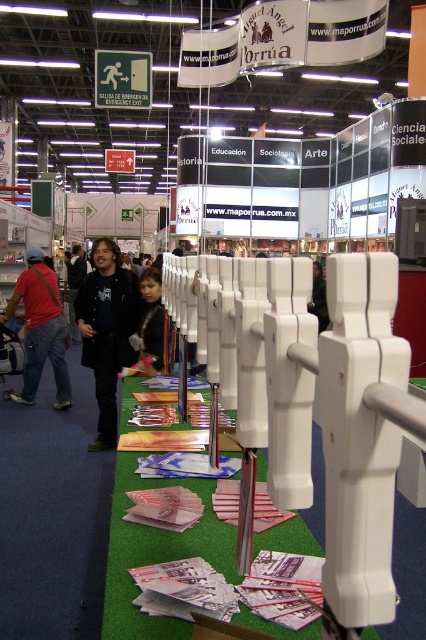
You are at an educational trade show and see two black items. One is the black matte jacket at left and the other is the black fabric at center. Which one is positioned more to the left?

The black matte jacket at left is positioned more to the left than the black fabric at center.

You are an event photographer at the exhibition. You need to capture a photo that includes both the matte red shirt at left and the black fabric at center. Which object should you focus on first to ensure both are in frame?

You should focus on the matte red shirt at left first because it is bigger than the black fabric at center, so it will be easier to frame both objects in the photo.

You are at the exhibition and want to find the matte black jacket at center. According to the coordinates provided, where should you look?

The matte black jacket at center is located at coordinates point (x=74, y=284).